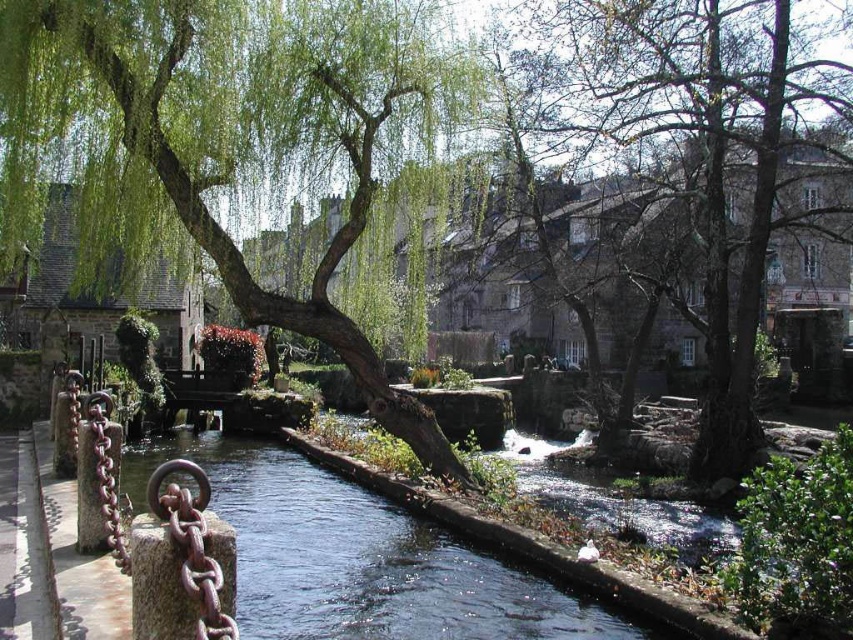
Does green leafy willow at center have a larger size compared to smooth bark tree at center?

Incorrect, green leafy willow at center is not larger than smooth bark tree at center.

Is green leafy willow at center shorter than smooth bark tree at center?

Indeed, green leafy willow at center has a lesser height compared to smooth bark tree at center.

Which is in front, point (303, 109) or point (724, 156)?

Positioned in front is point (303, 109).

Locate an element on the screen. green leafy willow at center is located at coordinates (229, 134).

Does smooth bark tree at center lie behind clear water at center?

That is True.

Does smooth bark tree at center appear under clear water at center?

Incorrect, smooth bark tree at center is not positioned below clear water at center.

Is point (749, 417) behind point (430, 568)?

Yes.

The width and height of the screenshot is (853, 640). Find the location of `smooth bark tree at center`. smooth bark tree at center is located at coordinates (699, 152).

Does green leafy willow at center come in front of clear water at center?

No, green leafy willow at center is further to the viewer.

Can you confirm if green leafy willow at center is positioned to the left of clear water at center?

Indeed, green leafy willow at center is positioned on the left side of clear water at center.

Describe the element at coordinates (229, 134) in the screenshot. I see `green leafy willow at center` at that location.

Where is `green leafy willow at center`? green leafy willow at center is located at coordinates (229, 134).